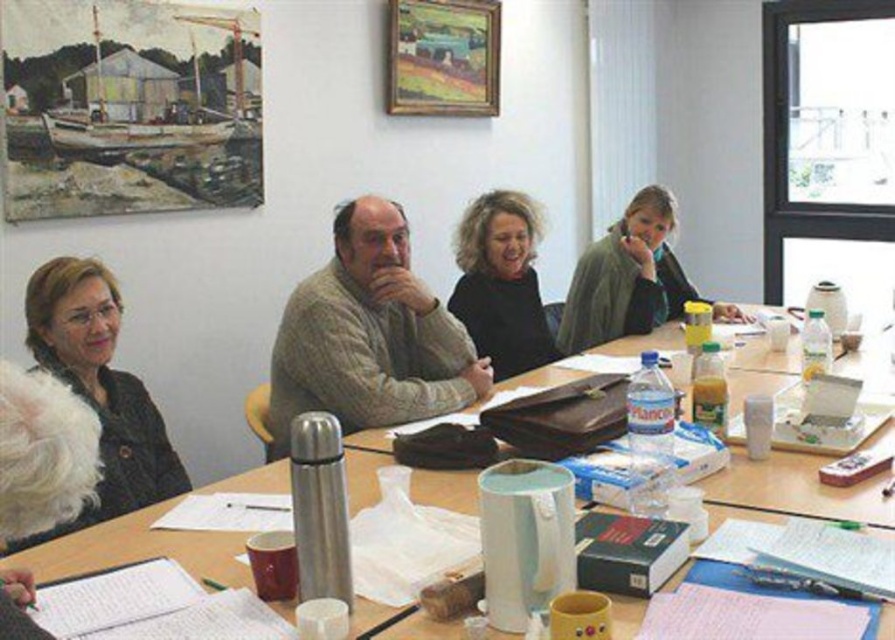
You are organizing a meeting and need to place a new folder on the table. The folder is the same size as the white paper at upper left. Can you fit it vertically next to the black sweater at center without overlapping?

The white paper at upper left is not as tall as the black sweater at center. Since the folder is the same size as the white paper, it would also be shorter than the sweater. Therefore, placing it vertically next to the black sweater at center should be possible without overlapping as it is shorter in height.

Based on the photo, you are standing in the meeting room and want to place a new item exactly where the light brown sweater at center is currently located. What are the coordinates where you should place the new item?

The coordinates for the light brown sweater at center are at point (369, 336), so you should place the new item at those coordinates.

Based on the photo, you are sitting at the rectangular wooden table in the meeting room and notice two sweaters at the center. Which sweater is closer to you, the light brown sweater at center or the black sweater at center?

The light brown sweater at center is closer to you because it is in front of the black sweater at center.